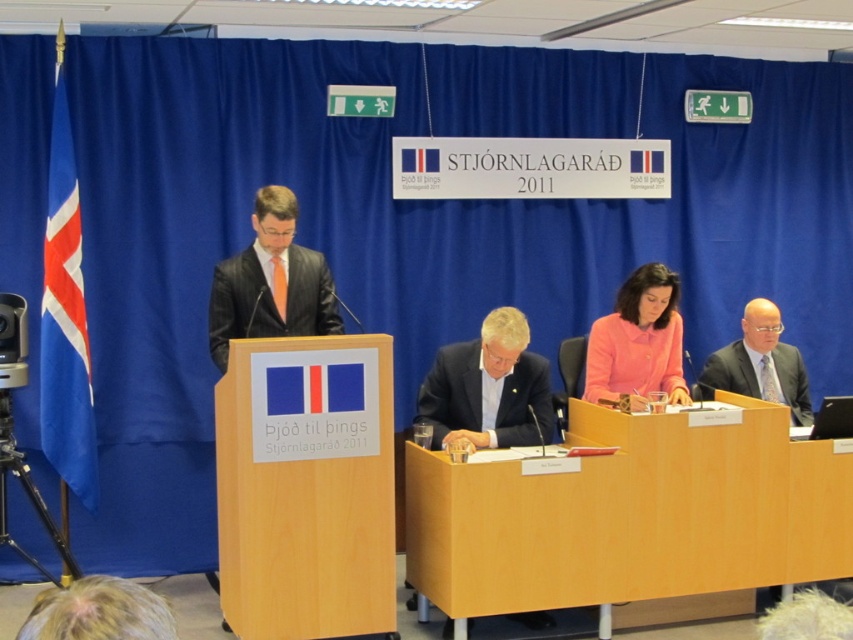
Question: Does light brown wood table at center have a greater width compared to blue fabric flag at left?

Choices:
 (A) yes
 (B) no

Answer: (A)

Question: Can you confirm if dark blue fabric suit at center is positioned to the left of matte black suit at right?

Choices:
 (A) yes
 (B) no

Answer: (A)

Question: Estimate the real-world distances between objects in this image. Which object is farther from the blonde hair at lower left?

Choices:
 (A) matte black suit at right
 (B) matte black suit at center
 (C) blue fabric flag at left
 (D) dark blue fabric suit at center

Answer: (A)

Question: Which point is farther to the camera?

Choices:
 (A) (51, 230)
 (B) (444, 486)
 (C) (614, 392)
 (D) (74, 620)

Answer: (C)

Question: Which point is closer to the camera taking this photo?

Choices:
 (A) (662, 284)
 (B) (80, 227)
 (C) (762, 426)
 (D) (787, 355)

Answer: (C)

Question: Can you confirm if dark blue fabric suit at center is positioned above matte black suit at center?

Choices:
 (A) no
 (B) yes

Answer: (A)